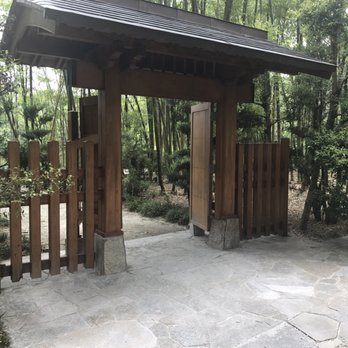
What are the coordinates of `door frame` in the screenshot? It's located at (194, 89), (113, 205), (228, 185).